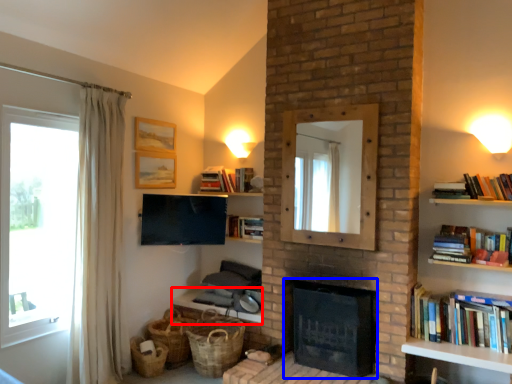
Question: Which object appears closest to the camera in this image, table (highlighted by a red box) or fireplace (highlighted by a blue box)?

Choices:
 (A) table
 (B) fireplace

Answer: (B)